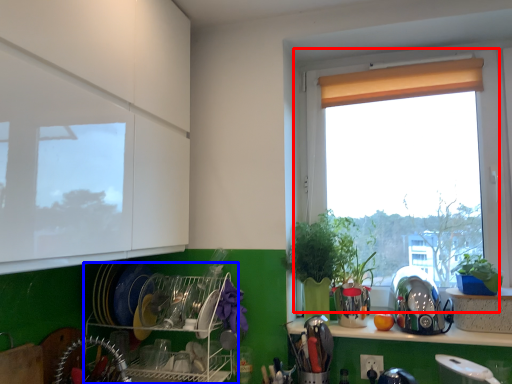
Question: Among these objects, which one is nearest to the camera, window (highlighted by a red box) or shelf (highlighted by a blue box)?

Choices:
 (A) window
 (B) shelf

Answer: (B)